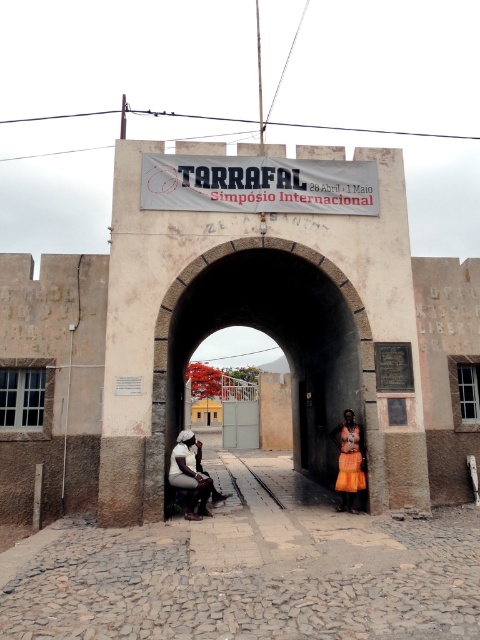
Does stone archway at center appear on the right side of orange fabric skirt at center?

Indeed, stone archway at center is positioned on the right side of orange fabric skirt at center.

Measure the distance from stone archway at center to orange fabric skirt at center.

1.46 meters

Locate an element on the screen. stone archway at center is located at coordinates (278, 342).